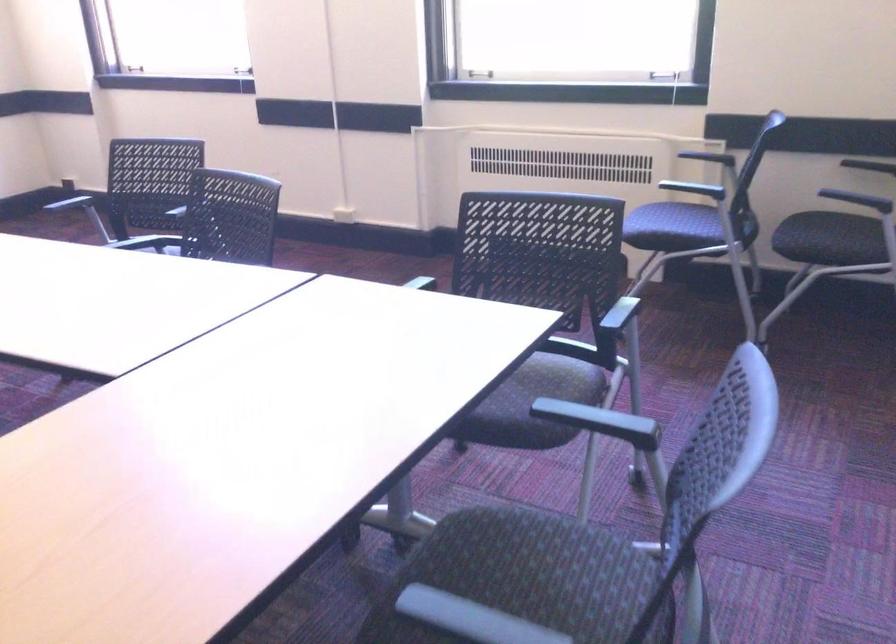
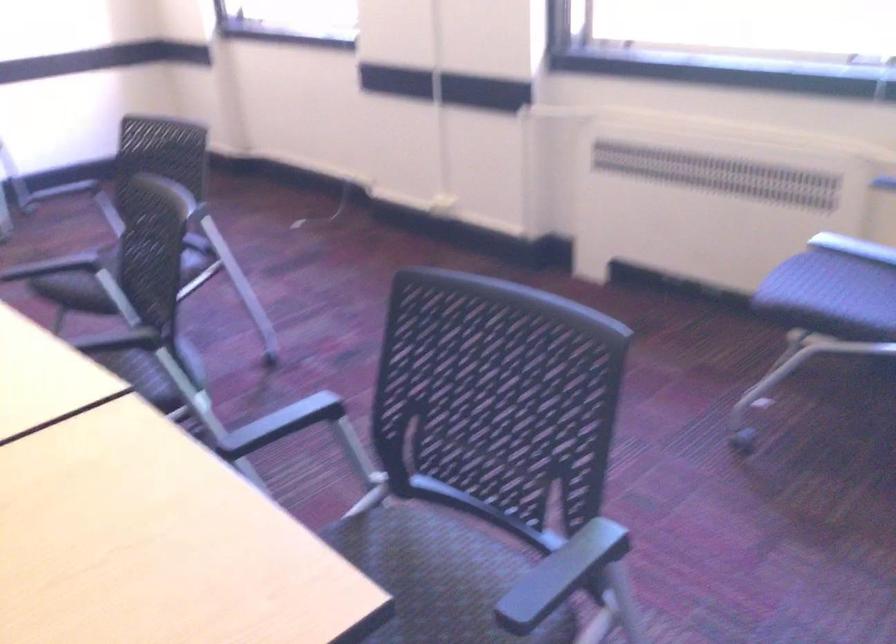
What movement of the cameraman would produce the second image?

The cameraman walked toward right, forward.